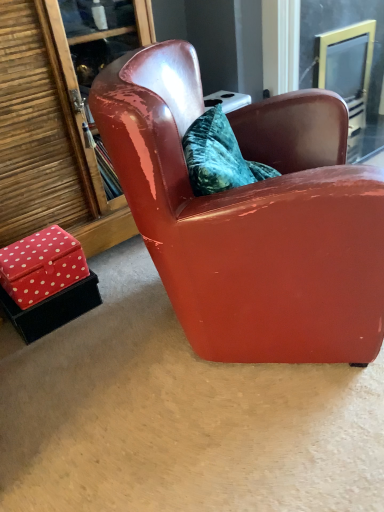
Where is `free spot in front of glossy leather armchair at center`? Image resolution: width=384 pixels, height=512 pixels. free spot in front of glossy leather armchair at center is located at coordinates (244, 438).